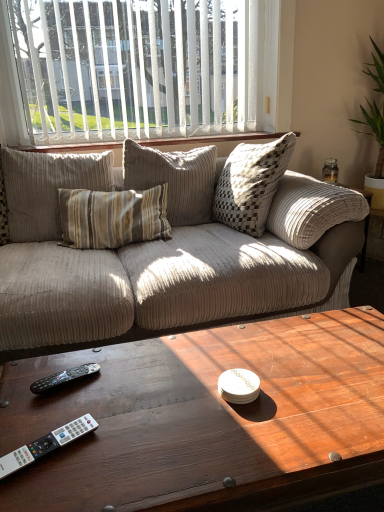
Question: Considering the positions of white vertical blinds at upper center and wooden at upper center in the image, is white vertical blinds at upper center wider or thinner than wooden at upper center?

Choices:
 (A) wide
 (B) thin

Answer: (B)

Question: Would you say white vertical blinds at upper center is to the left or to the right of wooden at upper center in the picture?

Choices:
 (A) left
 (B) right

Answer: (A)

Question: Estimate the real-world distances between objects in this image. Which object is farther from the white vertical blinds at upper center?

Choices:
 (A) wooden coffee table at center
 (B) wooden at upper center
 (C) black plastic remote control at lower left, the 2th remote control in the front-to-back sequence
 (D) white plastic remote control at lower left, which is counted as the first remote control, starting from the bottom
 (E) beige corduroy pillow at center

Answer: (D)

Question: Which object is positioned farthest from the wooden at upper center?

Choices:
 (A) wooden coffee table at center
 (B) black plastic remote control at lower left, the 2th remote control in the front-to-back sequence
 (C) white plastic remote control at lower left, marked as the 1th remote control in a front-to-back arrangement
 (D) beige corduroy pillow at center
 (E) white vertical blinds at upper center

Answer: (C)